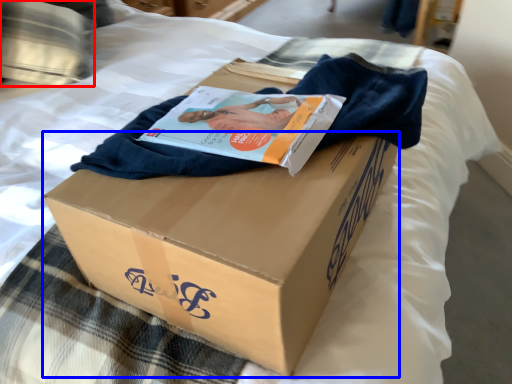
Question: Which point is closer to the camera, pillow (highlighted by a red box) or cardboard box (highlighted by a blue box)?

Choices:
 (A) pillow
 (B) cardboard box

Answer: (B)